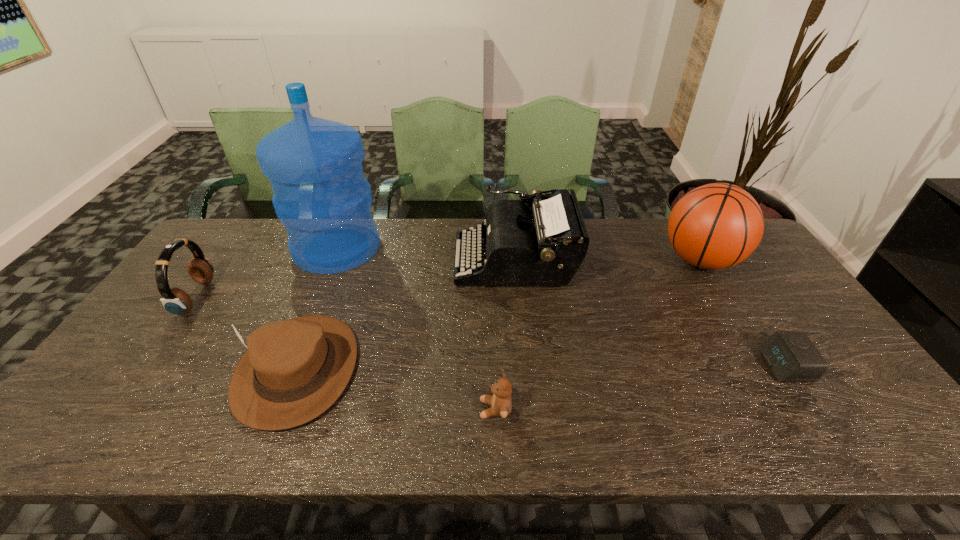
The image size is (960, 540). Find the location of `water jug`. water jug is located at coordinates (314, 165).

At what (x,y) coordinates should I click in order to perform the action: click on the sixth shortest object. Please return your answer as a coordinate pair (x, y). This screenshot has width=960, height=540. Looking at the image, I should click on click(x=715, y=226).

Locate an element on the screen. This screenshot has width=960, height=540. typewriter is located at coordinates (543, 246).

Identify the location of the leftmost object. (176, 301).

Identify the location of fedora. (293, 370).

I want to click on teddy bear, so click(x=501, y=404).

Locate an element on the screen. alarm clock is located at coordinates click(x=791, y=355).

This screenshot has height=540, width=960. Find the location of `vacant space located on the front of the tallest object`. vacant space located on the front of the tallest object is located at coordinates (300, 336).

Find the location of `vacant region located on the left of the sixth shortest object`. vacant region located on the left of the sixth shortest object is located at coordinates (564, 261).

At what (x,y) coordinates should I click in order to perform the action: click on free space located on the typing side of the typewriter. Please return your answer as a coordinate pair (x, y). Looking at the image, I should click on (388, 260).